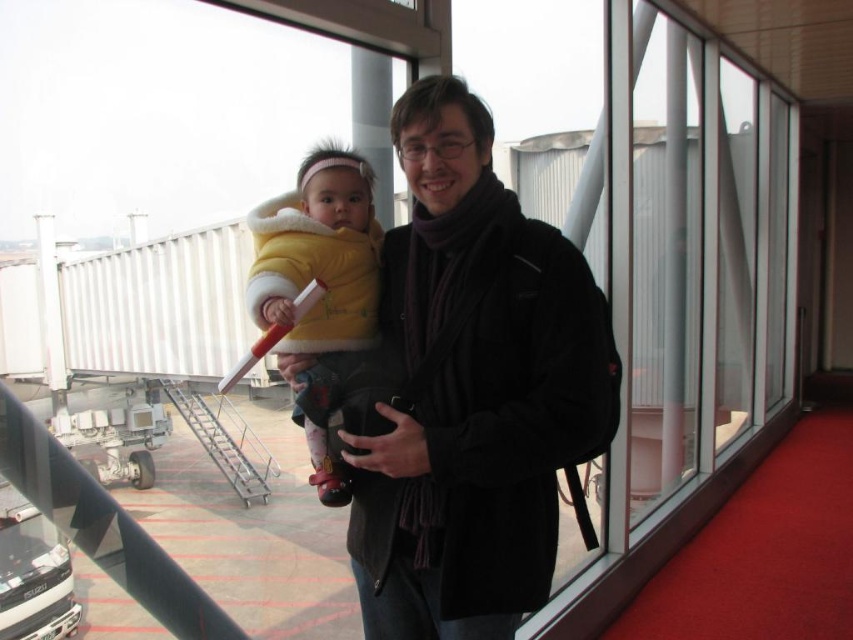
Is matte black jacket at center taller than yellow fleece jacket at center?

Yes.

Does point (393, 141) lie in front of point (339, 493)?

That is True.

The height and width of the screenshot is (640, 853). Describe the element at coordinates (473, 388) in the screenshot. I see `matte black jacket at center` at that location.

You are a GUI agent. You are given a task and a screenshot of the screen. Output one action in this format:
    pyautogui.click(x=<x>, y=<y>)
    Task: Click on the matte black jacket at center
    
    Given the screenshot: What is the action you would take?
    pyautogui.click(x=473, y=388)